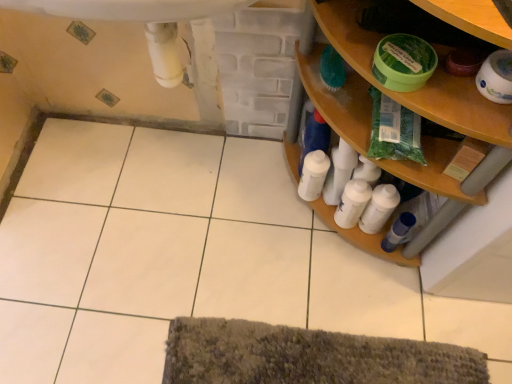
Identify the location of vacant space that is to the left of white glossy bottles at center right, which is the second toiletry in left-to-right order. (305, 238).